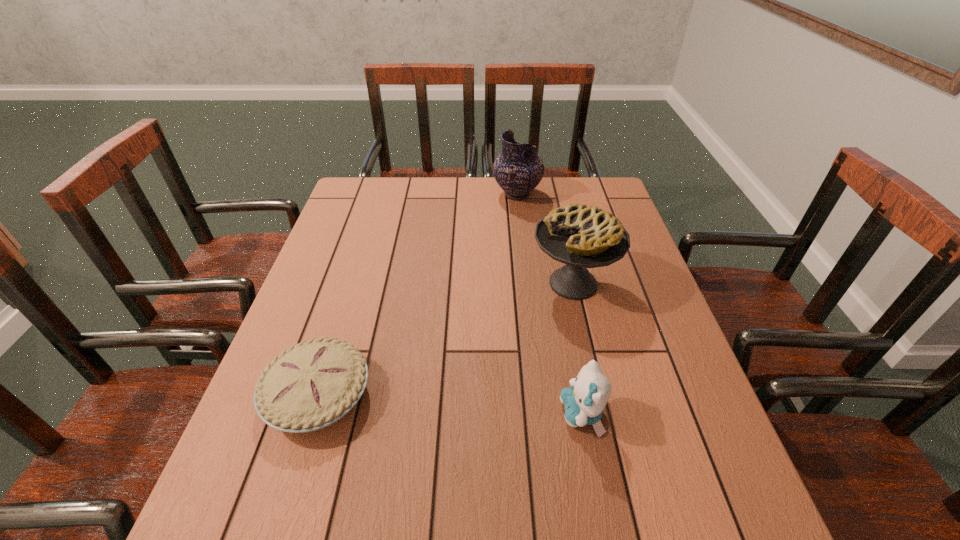
Image resolution: width=960 pixels, height=540 pixels. Identify the location of the farthest object. (518, 170).

Where is `the taller pie`? the taller pie is located at coordinates (580, 236).

In order to click on the right pie in this screenshot , I will do `click(580, 236)`.

You are a GUI agent. You are given a task and a screenshot of the screen. Output one action in this format:
    pyautogui.click(x=<x>, y=<y>)
    Task: Click on the second shortest object
    The image size is (960, 540).
    Given the screenshot: What is the action you would take?
    pyautogui.click(x=584, y=402)

You are a GUI agent. You are given a task and a screenshot of the screen. Output one action in this format:
    pyautogui.click(x=<x>, y=<y>)
    Task: Click on the shortest object
    This screenshot has width=960, height=540.
    Given the screenshot: What is the action you would take?
    pyautogui.click(x=312, y=385)

You are a GUI agent. You are given a task and a screenshot of the screen. Output one action in this format:
    pyautogui.click(x=<x>, y=<y>)
    Task: Click on the leftmost object
    The image size is (960, 540).
    Given the screenshot: What is the action you would take?
    pyautogui.click(x=312, y=385)

This screenshot has width=960, height=540. I want to click on free location located 0.340m on the front of the pottery, so click(527, 278).

You are a GUI agent. You are given a task and a screenshot of the screen. Output one action in this format:
    pyautogui.click(x=<x>, y=<y>)
    Task: Click on the vacant region located on the cut side of the farther pie
    Image resolution: width=960 pixels, height=540 pixels.
    Given the screenshot: What is the action you would take?
    pyautogui.click(x=511, y=284)

You are a GUI agent. You are given a task and a screenshot of the screen. Output one action in this format:
    pyautogui.click(x=<x>, y=<y>)
    Task: Click on the vacant position located 0.180m on the cut side of the farther pie
    This screenshot has width=960, height=540.
    Given the screenshot: What is the action you would take?
    pyautogui.click(x=462, y=284)

The image size is (960, 540). Identify the location of free point located on the cut side of the farther pie. (428, 284).